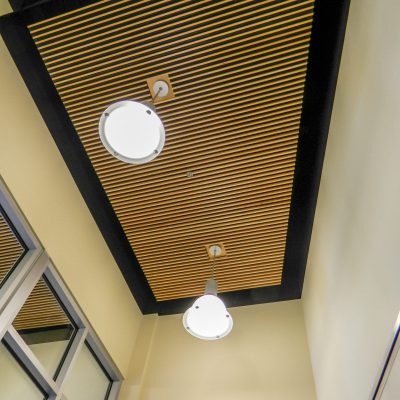
You are a GUI agent. You are given a task and a screenshot of the screen. Output one action in this format:
    pyautogui.click(x=<x>, y=<y>)
    Task: Click on the metal frame
    
    Given the screenshot: What is the action you would take?
    pyautogui.click(x=85, y=323), pyautogui.click(x=36, y=250)